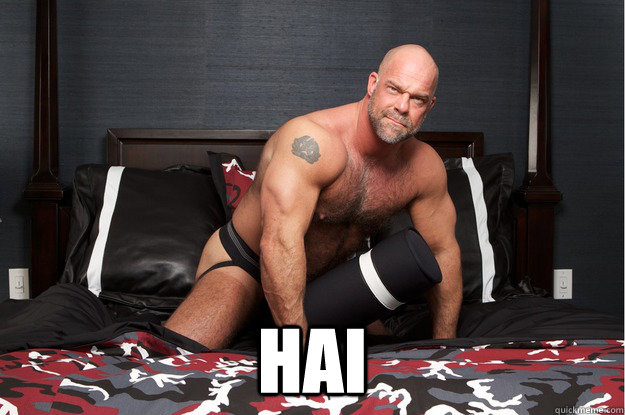
Where is `white outlet`? Image resolution: width=625 pixels, height=415 pixels. white outlet is located at coordinates (20, 280).